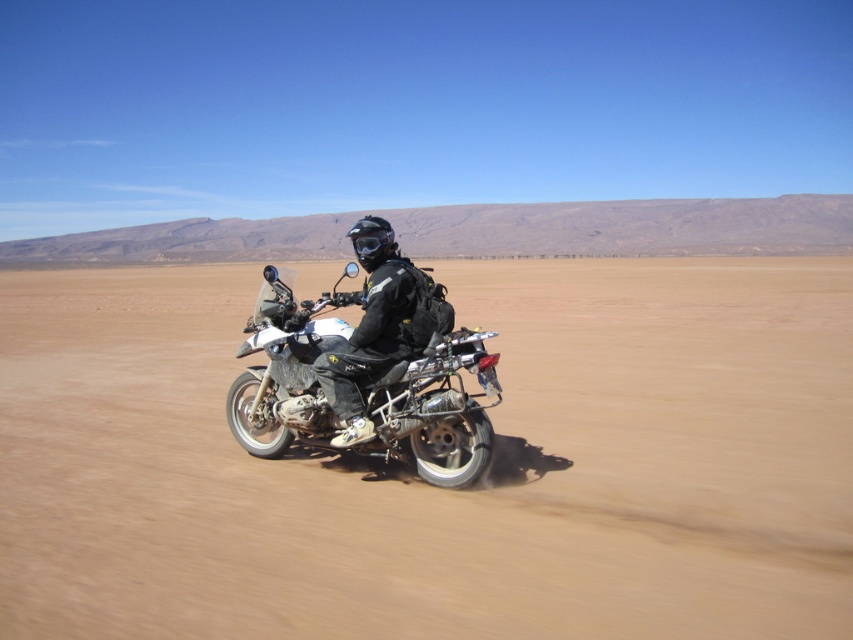
You are a photographer trying to capture a clear photo of the matte black motorcycle at center and the black matte jacket at center. The camera you are using has a minimum focus distance of 6 inches. Can you focus on both objects simultaneously without moving the camera?

The distance between the matte black motorcycle at center and the black matte jacket at center is 6.91 inches, which is greater than the camera minimum focus distance of 6 inches. Therefore, you can focus on both objects simultaneously without moving the camera.

You are a photographer positioned at the edge of the desert scene. You want to capture a photo where the matte black motorcycle at center and the black matte jacket at center are both visible. Based on their positions, which object should appear to the right in your photo?

The black matte jacket at center appears to the right of the matte black motorcycle at center in the photo because the motorcycle is positioned to the left of the jacket according to the description.

The motorcyclist wants to know if they can safely pass between the brown sandy terrain at center and the motorcycle. How far apart are they?

The brown sandy terrain at center and the motorcycle are 2.90 meters apart, so the motorcyclist can safely pass between them as the distance is sufficient for maneuvering.